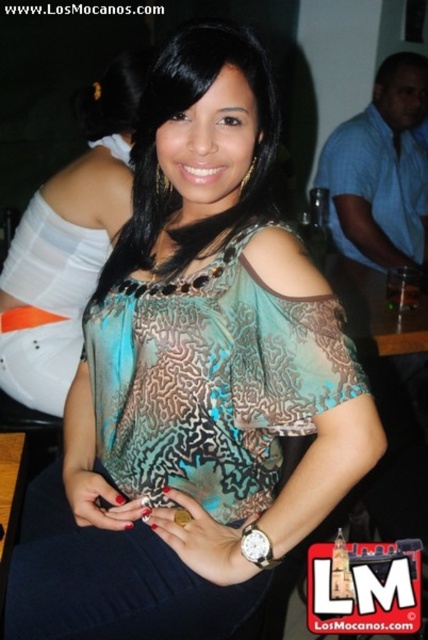
You are a photographer at the event and want to take a closeup of the woman. Which blouse, the matte teal blouse at center or the patterned sheer blouse at center, is closer to the camera?

The matte teal blouse at center is closer to the camera because the patterned sheer blouse at center is behind it.

You are a fashion designer observing the image and want to place a necklace between the matte teal blouse at center and the patterned sheer blouse at center. The necklace requires 18 inches of space to hang properly. Do you think there is enough space between them?

The matte teal blouse at center is 17.52 inches away from the patterned sheer blouse at center. Since the required space is 18 inches, there isn not enough space to place the necklace between them.